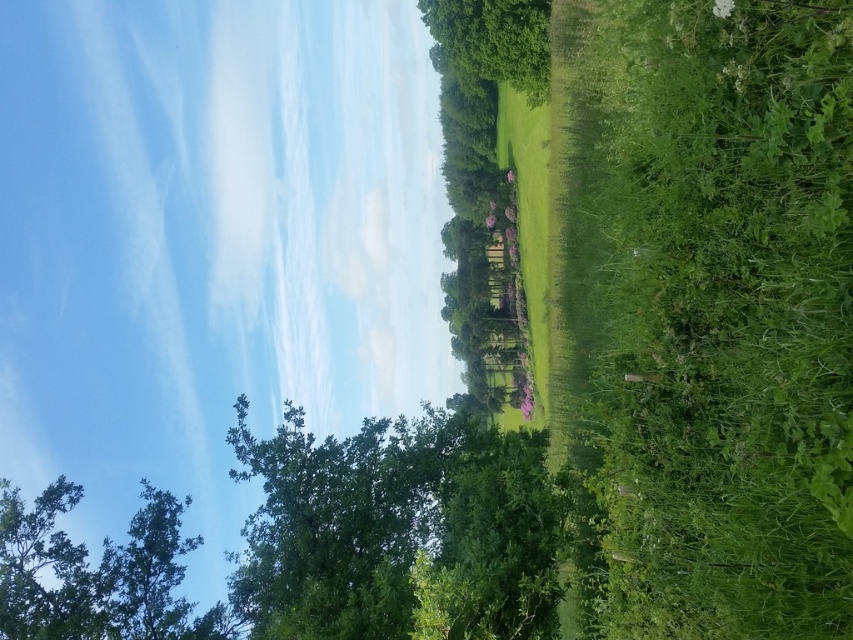
You are standing at the point labeled as point (337, 524) in the image. Based on the scene description, what type of object are you currently standing on?

The point (337, 524) is on a green leafy tree at center, so you are standing on a green leafy tree.

You are a painter setting up your easel in the field. You want to paint both the green leafy tree at lower left and the green leafy tree at upper center. Which tree would you need to move closer to in order to capture its full width in your painting?

Answer: The green leafy tree at lower left has a lesser width compared to the green leafy tree at upper center. Therefore, you would need to move closer to the green leafy tree at lower left to ensure its entire width fits within your painting.

You are a landscape architect planning to install a 5.5 meter wide garden path between the green leafy tree at center and the green leafy tree at lower left. Based on the scene description, will the path fit between them without cutting down either tree?

The green leafy tree at center and green leafy tree at lower left are 6.26 meters apart from each other. Since the path is 5.5 meters wide, which is narrower than the distance between the trees, the path can be placed between them without cutting down either tree.